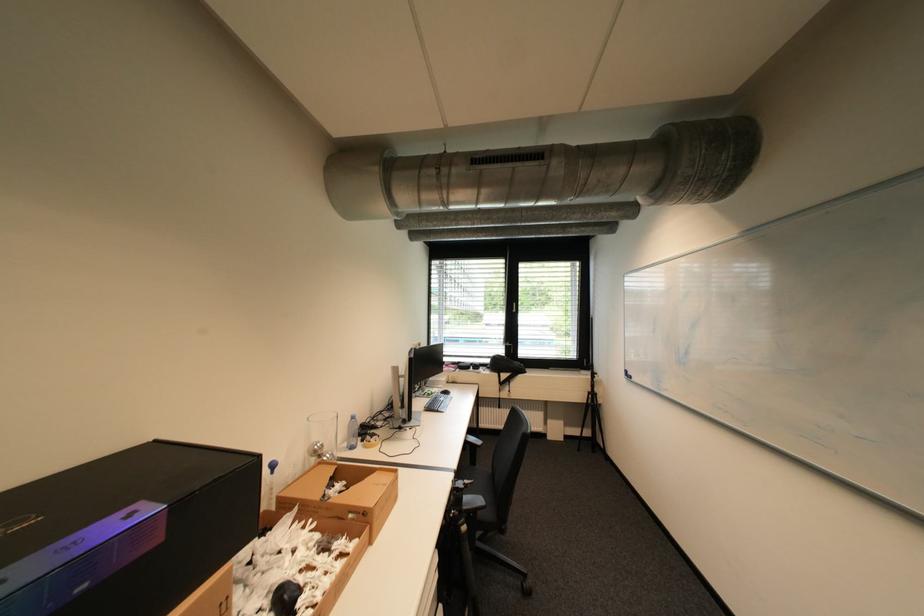
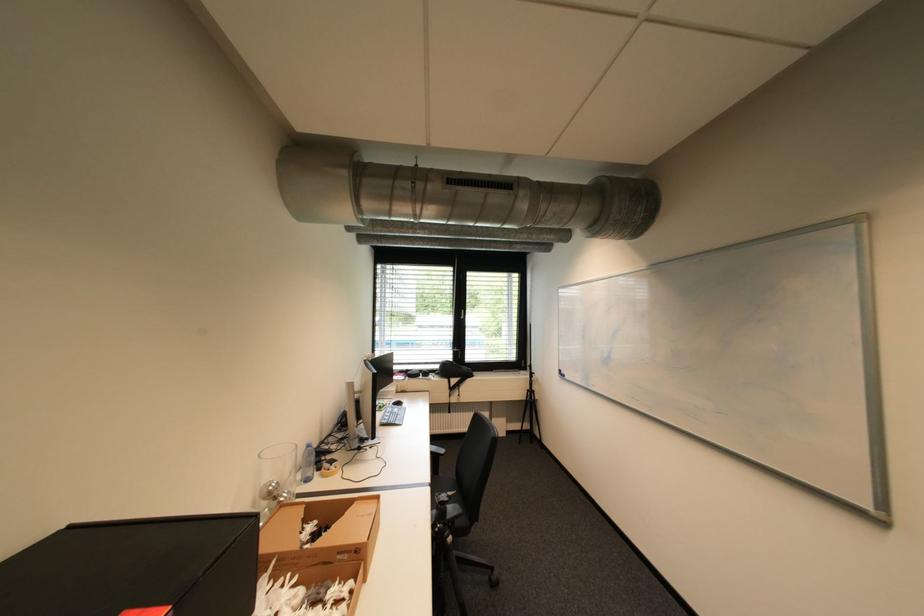
Question: Based on the continuous images, in which direction is the camera rotating? Reply with the corresponding letter.

Choices:
 (A) Left
 (B) Right
 (C) Up
 (D) Down

Answer: (B)